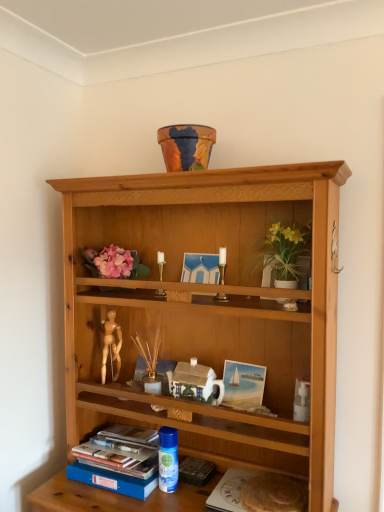
Question: Is the position of white ceramic vase at upper center more distant than that of blue plastic spray can at lower center?

Choices:
 (A) yes
 (B) no

Answer: (B)

Question: Considering the relative sizes of white ceramic vase at upper center and blue plastic spray can at lower center in the image provided, is white ceramic vase at upper center wider than blue plastic spray can at lower center?

Choices:
 (A) yes
 (B) no

Answer: (A)

Question: Does white ceramic vase at upper center come in front of blue plastic spray can at lower center?

Choices:
 (A) yes
 (B) no

Answer: (A)

Question: Is blue plastic spray can at lower center surrounded by white ceramic vase at upper center?

Choices:
 (A) no
 (B) yes

Answer: (A)

Question: Can you confirm if white ceramic vase at upper center is smaller than blue plastic spray can at lower center?

Choices:
 (A) no
 (B) yes

Answer: (A)

Question: From a real-world perspective, is blue plastic spray can at lower center above or below gold metallic candle holder at center, which is counted as the first candle holder, starting from the back?

Choices:
 (A) below
 (B) above

Answer: (A)

Question: Considering the positions of blue plastic spray can at lower center and gold metallic candle holder at center, the second candle holder viewed from the right, in the image, is blue plastic spray can at lower center bigger or smaller than gold metallic candle holder at center, the second candle holder viewed from the right,?

Choices:
 (A) small
 (B) big

Answer: (B)

Question: Is blue plastic spray can at lower center taller or shorter than gold metallic candle holder at center, the second candle holder viewed from the right?

Choices:
 (A) tall
 (B) short

Answer: (A)

Question: Considering the positions of blue plastic spray can at lower center and gold metallic candle holder at center, which is counted as the first candle holder, starting from the back, in the image, is blue plastic spray can at lower center wider or thinner than gold metallic candle holder at center, which is counted as the first candle holder, starting from the back,?

Choices:
 (A) thin
 (B) wide

Answer: (B)

Question: From the image's perspective, relative to blue plastic spray can at lower center, is gold metallic candle holder at center, positioned as the 1th candle holder in front-to-back order, above or below?

Choices:
 (A) above
 (B) below

Answer: (A)

Question: Considering the positions of gold metallic candle holder at center, the 2th candle holder viewed from the left, and blue plastic spray can at lower center in the image, is gold metallic candle holder at center, the 2th candle holder viewed from the left, wider or thinner than blue plastic spray can at lower center?

Choices:
 (A) wide
 (B) thin

Answer: (B)

Question: From a real-world perspective, relative to blue plastic spray can at lower center, is gold metallic candle holder at center, which is the second candle holder in back-to-front order, vertically above or below?

Choices:
 (A) above
 (B) below

Answer: (A)

Question: Considering their positions, is gold metallic candle holder at center, which is the second candle holder in back-to-front order, located in front of or behind blue plastic spray can at lower center?

Choices:
 (A) behind
 (B) front

Answer: (B)

Question: Is point (114, 465) closer or farther from the camera than point (276, 480)?

Choices:
 (A) farther
 (B) closer

Answer: (A)

Question: From their relative heights in the image, would you say blue hardcover book at lower left is taller or shorter than white matte paper at lower center?

Choices:
 (A) tall
 (B) short

Answer: (A)